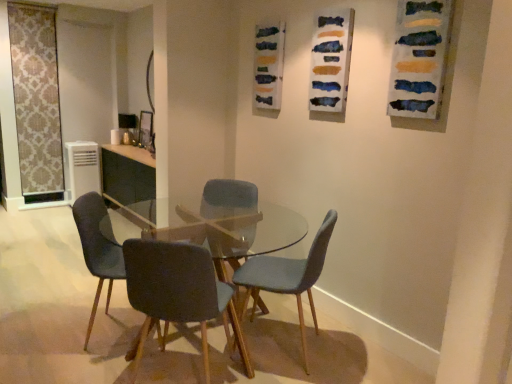
Question: Which direction should I rotate to face matte blue fabric chair at center, which appears as the 4th chair when viewed from the left, — up or down?

Choices:
 (A) up
 (B) down

Answer: (B)

Question: From a real-world perspective, is velvet dark blue chair at center, acting as the 1th chair starting from the left, physically above clear glass table at center?

Choices:
 (A) yes
 (B) no

Answer: (A)

Question: Considering the relative sizes of velvet dark blue chair at center, which is the 4th chair in right-to-left order, and clear glass table at center in the image provided, is velvet dark blue chair at center, which is the 4th chair in right-to-left order, shorter than clear glass table at center?

Choices:
 (A) no
 (B) yes

Answer: (A)

Question: Is velvet dark blue chair at center, which is the 4th chair in right-to-left order, not near clear glass table at center?

Choices:
 (A) yes
 (B) no

Answer: (B)

Question: Does velvet dark blue chair at center, which is the 4th chair in right-to-left order, have a smaller size compared to clear glass table at center?

Choices:
 (A) yes
 (B) no

Answer: (A)

Question: Does velvet dark blue chair at center, which is the 4th chair in right-to-left order, have a greater width compared to clear glass table at center?

Choices:
 (A) yes
 (B) no

Answer: (B)

Question: Does velvet dark blue chair at center, acting as the 1th chair starting from the left, appear on the right side of clear glass table at center?

Choices:
 (A) yes
 (B) no

Answer: (B)

Question: Is velvet blue chair at center, the 3th chair in the left-to-right sequence, next to watercolor paint at upper center and touching it?

Choices:
 (A) no
 (B) yes

Answer: (A)

Question: Considering the relative positions of velvet blue chair at center, the 3th chair in the left-to-right sequence, and watercolor paint at upper center in the image provided, is velvet blue chair at center, the 3th chair in the left-to-right sequence, to the left of watercolor paint at upper center from the viewer's perspective?

Choices:
 (A) no
 (B) yes

Answer: (B)

Question: Is velvet blue chair at center, which ranks as the 2th chair in right-to-left order, positioned with its back to watercolor paint at upper center?

Choices:
 (A) yes
 (B) no

Answer: (B)

Question: Can we say velvet blue chair at center, the 3th chair in the left-to-right sequence, lies outside watercolor paint at upper center?

Choices:
 (A) yes
 (B) no

Answer: (A)

Question: From the image's perspective, is velvet blue chair at center, which ranks as the 2th chair in right-to-left order, located above watercolor paint at upper center?

Choices:
 (A) yes
 (B) no

Answer: (B)

Question: Is velvet blue chair at center, the 3th chair in the left-to-right sequence, at the right side of watercolor paint at upper center?

Choices:
 (A) no
 (B) yes

Answer: (A)

Question: Is watercolor paint at upper center outside of white plastic air conditioner at left?

Choices:
 (A) no
 (B) yes

Answer: (B)